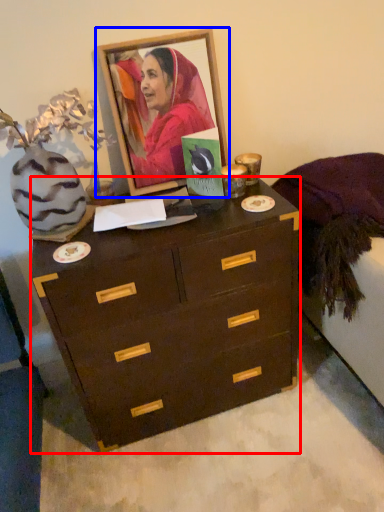
Question: Which object is closer to the camera taking this photo, chest of drawers (highlighted by a red box) or picture frame (highlighted by a blue box)?

Choices:
 (A) chest of drawers
 (B) picture frame

Answer: (A)